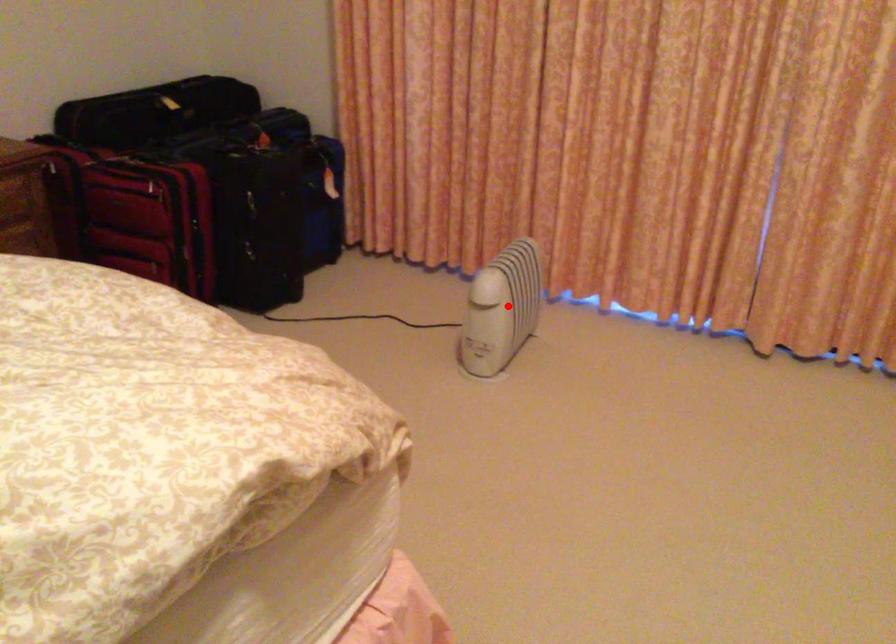
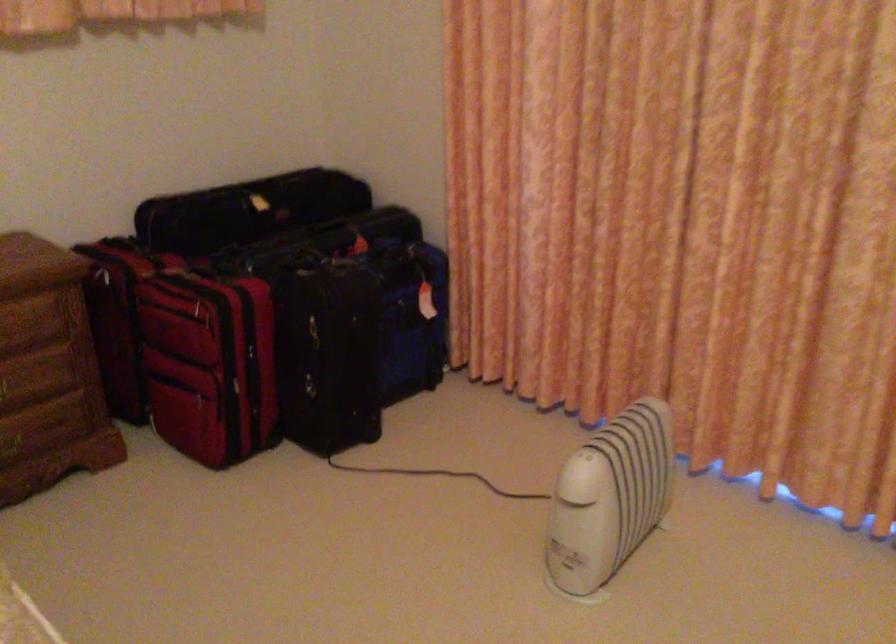
Locate, in the second image, the point that corresponds to the highlighted location in the first image.

(609, 498)